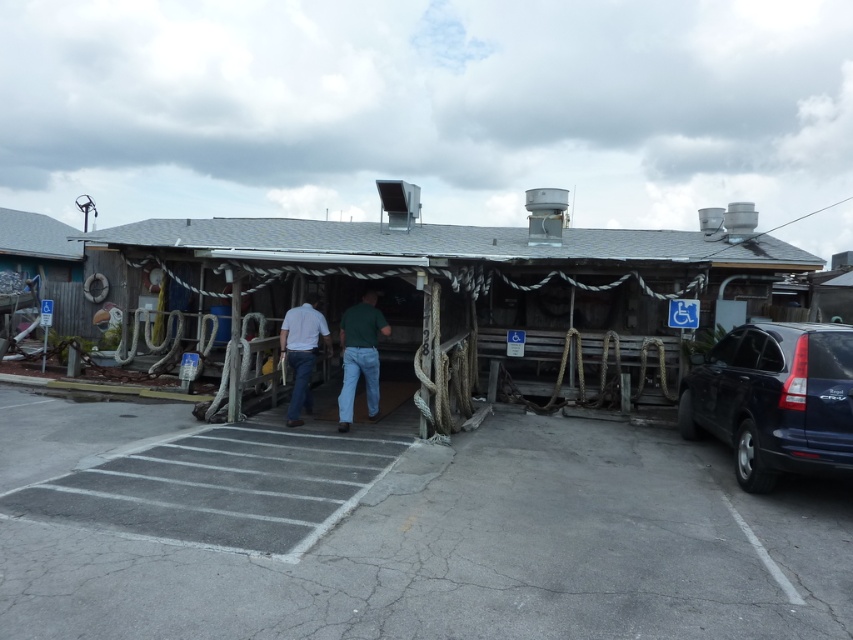
Question: Does wooden hut at left appear on the right side of matte white shirt at center?

Choices:
 (A) yes
 (B) no

Answer: (B)

Question: Based on their relative distances, which object is farther from the matte white shirt at center?

Choices:
 (A) gray asphalt parking lot at lower center
 (B) shiny blue suv at right
 (C) wooden hut at left

Answer: (C)

Question: Can you confirm if wooden hut at center is positioned below shiny blue suv at right?

Choices:
 (A) yes
 (B) no

Answer: (B)

Question: Which object is closer to the camera taking this photo?

Choices:
 (A) gray asphalt parking lot at lower center
 (B) shiny blue suv at right
 (C) matte white shirt at center

Answer: (A)

Question: Which is farther from the green cotton shirt at center?

Choices:
 (A) gray asphalt parking lot at lower center
 (B) wooden hut at left
 (C) matte white shirt at center
 (D) shiny blue suv at right

Answer: (B)

Question: Can you confirm if shiny blue suv at right is positioned to the right of wooden hut at left?

Choices:
 (A) yes
 (B) no

Answer: (A)